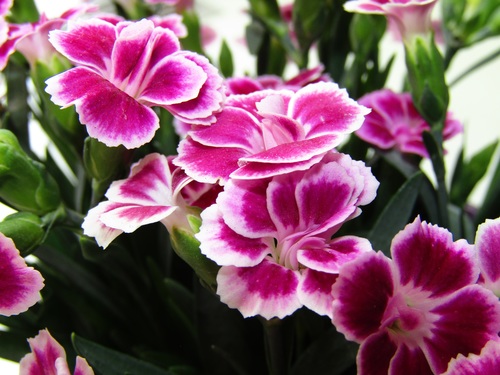
Locate an element on the screen. green plant stems is located at coordinates (443, 204), (301, 68), (445, 64).